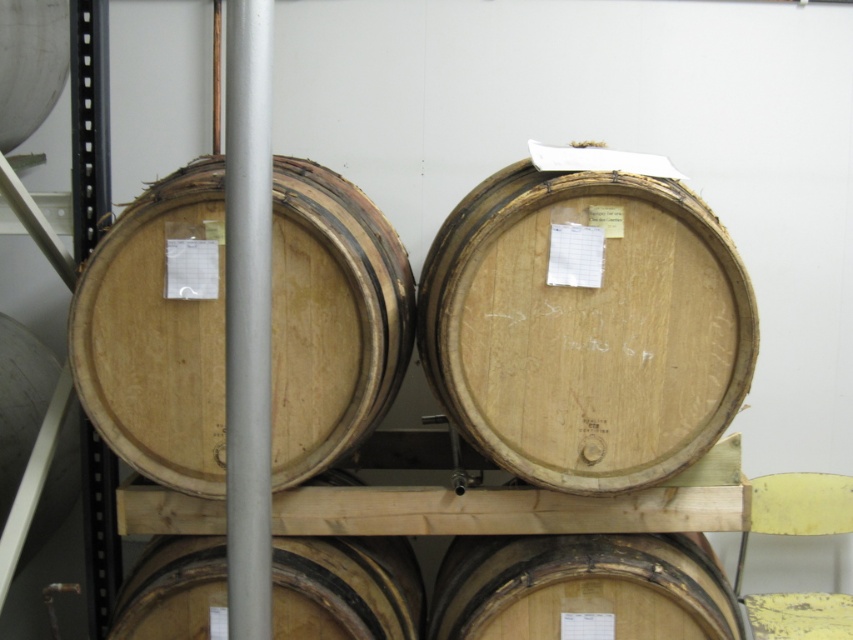
Which of these two, wooden barrel at lower center or natural wood barrel at lower center, stands taller?

Standing taller between the two is natural wood barrel at lower center.

Can you confirm if wooden barrel at lower center is positioned to the left of natural wood barrel at lower center?

No, wooden barrel at lower center is not to the left of natural wood barrel at lower center.

Who is more distant from viewer, (467, 550) or (364, 602)?

The point (467, 550) is more distant.

Locate an element on the screen. The image size is (853, 640). wooden barrel at lower center is located at coordinates (581, 589).

Which is below, natural wood barrel at left or natural wood barrel at lower center?

Positioned lower is natural wood barrel at lower center.

In the scene shown: Can you confirm if natural wood barrel at left is positioned below natural wood barrel at lower center?

No.

Who is more distant from viewer, [100,243] or [173,589]?

The point [173,589] is behind.

You are a GUI agent. You are given a task and a screenshot of the screen. Output one action in this format:
    pyautogui.click(x=<x>, y=<y>)
    Task: Click on the natural wood barrel at left
    Image resolution: width=853 pixels, height=640 pixels.
    Given the screenshot: What is the action you would take?
    pyautogui.click(x=158, y=332)

Looking at this image, can you confirm if natural wood barrel at left is positioned below wooden barrel at lower center?

Actually, natural wood barrel at left is above wooden barrel at lower center.

Is point (317, 387) positioned behind point (462, 632)?

No, it is not.

Who is more distant from viewer, [170,326] or [556,540]?

Positioned behind is point [556,540].

This screenshot has width=853, height=640. In order to click on natural wood barrel at left in this screenshot , I will do `click(158, 332)`.